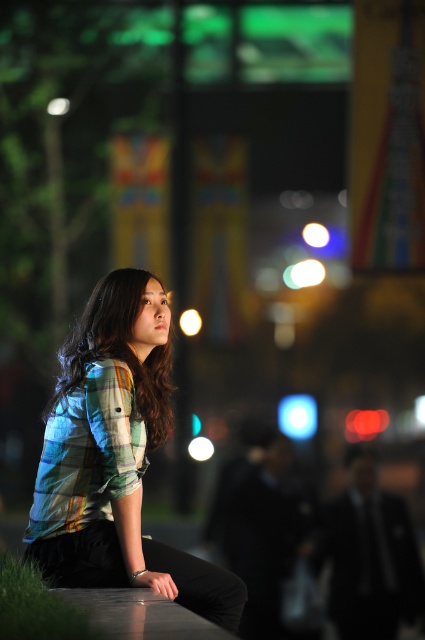
Between plaid fabric shirt at center and plaid shirt at center, which one appears on the left side from the viewer's perspective?

plaid shirt at center

Is plaid fabric shirt at center taller than plaid shirt at center?

Yes.

In the scene shown: Who is more distant from viewer, [144,564] or [147,356]?

The point [147,356] is more distant.

The width and height of the screenshot is (425, 640). What are the coordinates of `plaid fabric shirt at center` in the screenshot? It's located at (116, 456).